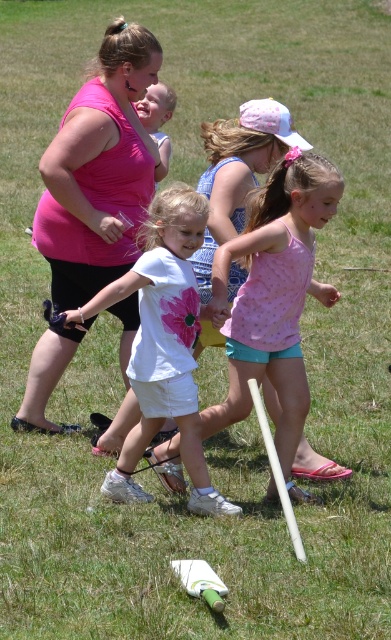
You are a photographer trying to capture a photo of both the pink dotted tank top at center and the pink matte shirt at center in the same frame. The camera you are using has a maximum focus range of 5 feet. Can you fit both subjects within the camera focus range?

The distance between the pink dotted tank top at center and the pink matte shirt at center is 5.25 feet, which exceeds the camera focus range of 5 feet. Therefore, you cannot fit both subjects within the camera focus range.